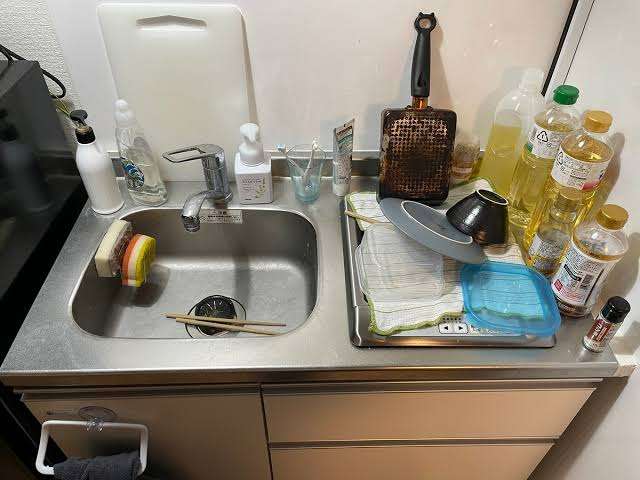
Where is `tooth brushes`? This screenshot has height=480, width=640. tooth brushes is located at coordinates (287, 156), (310, 156).